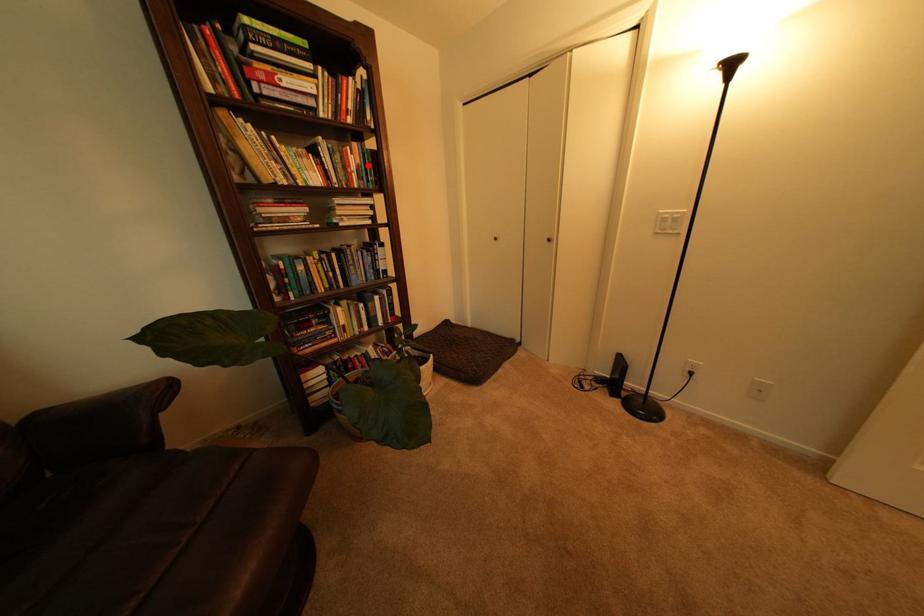
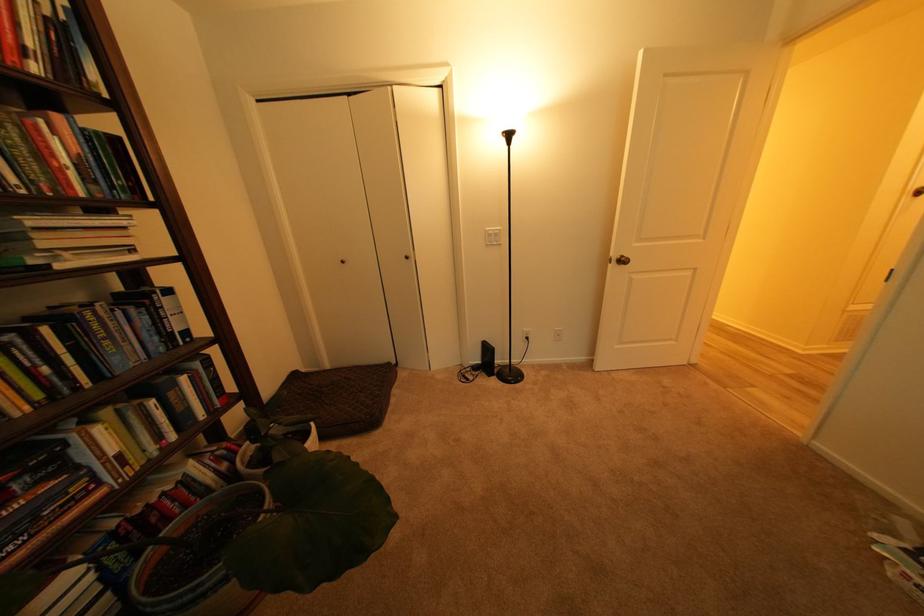
Question: I am providing you with two images of the same scene from different viewpoints. Image1 has a red point marked. In image2, the corresponding 3D location appears at what relative position? Reply with the corresponding letter.

Choices:
 (A) Closer
 (B) Farther

Answer: (B)